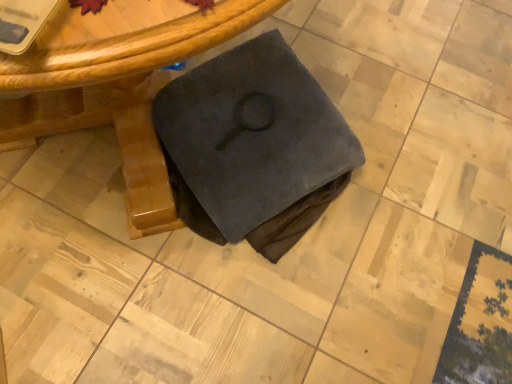
The height and width of the screenshot is (384, 512). Find the location of `wooden table at center`. wooden table at center is located at coordinates (117, 84).

What is the approximate width of wooden table at center?

The width of wooden table at center is 34.50 inches.

Image resolution: width=512 pixels, height=384 pixels. What do you see at coordinates (117, 84) in the screenshot?
I see `wooden table at center` at bounding box center [117, 84].

In order to face wooden table at center, should I rotate leftwards or rightwards?

Turn left approximately 19.901 degrees to face it.

Describe the element at coordinates (254, 146) in the screenshot. The width and height of the screenshot is (512, 384). I see `dark suede book at center` at that location.

At what (x,y) coordinates should I click in order to perform the action: click on dark suede book at center. Please return your answer as a coordinate pair (x, y). The width and height of the screenshot is (512, 384). Looking at the image, I should click on (254, 146).

This screenshot has height=384, width=512. Identify the location of wooden table at center. (117, 84).

Can you confirm if wooden table at center is positioned to the right of dark suede book at center?

In fact, wooden table at center is to the left of dark suede book at center.

Considering their positions, is wooden table at center located in front of or behind dark suede book at center?

Clearly, wooden table at center is in front of dark suede book at center.

Is point (106, 60) closer or farther from the camera than point (232, 233)?

Point (106, 60) appears to be closer to the viewer than point (232, 233).

From the image's perspective, which is above, wooden table at center or dark suede book at center?

wooden table at center is shown above in the image.

From a real-world perspective, does wooden table at center sit lower than dark suede book at center?

No, from a real-world perspective, wooden table at center is not beneath dark suede book at center.

Which object is thinner, wooden table at center or dark suede book at center?

With smaller width is dark suede book at center.

Does wooden table at center have a greater height compared to dark suede book at center?

Indeed, wooden table at center has a greater height compared to dark suede book at center.

Considering the sizes of objects wooden table at center and dark suede book at center in the image provided, who is bigger, wooden table at center or dark suede book at center?

wooden table at center.

Is wooden table at center not inside dark suede book at center?

Yes, wooden table at center is not within dark suede book at center.

Based on the photo, are wooden table at center and dark suede book at center beside each other?

No, wooden table at center is not with dark suede book at center.

Is wooden table at center looking in the opposite direction of dark suede book at center?

That's not correct — wooden table at center is not looking away from dark suede book at center.

How much distance is there between wooden table at center and dark suede book at center?

The distance of wooden table at center from dark suede book at center is 19.42 centimeters.

Find the location of a particular element. This screenshot has width=512, height=384. fabric below the wooden table at center (from a real-world perspective) is located at coordinates (254, 146).

Which is more to the right, dark suede book at center or wooden table at center?

From the viewer's perspective, dark suede book at center appears more on the right side.

In the scene shown: Considering their positions, is dark suede book at center located in front of or behind wooden table at center?

Clearly, dark suede book at center is behind wooden table at center.

Which is nearer, (289, 235) or (151, 194)?

Clearly, point (289, 235) is more distant from the camera than point (151, 194).

From the image's perspective, between dark suede book at center and wooden table at center, which one is located above?

wooden table at center appears higher in the image.

From a real-world perspective, between dark suede book at center and wooden table at center, who is vertically lower?

dark suede book at center is physically lower.

Between dark suede book at center and wooden table at center, which one has smaller width?

dark suede book at center.

Based on the photo, considering the relative sizes of dark suede book at center and wooden table at center in the image provided, is dark suede book at center taller than wooden table at center?

Incorrect, the height of dark suede book at center is not larger of that of wooden table at center.

Does dark suede book at center have a larger size compared to wooden table at center?

Actually, dark suede book at center might be smaller than wooden table at center.

Is dark suede book at center spatially inside wooden table at center, or outside of it?

dark suede book at center is contained in wooden table at center.

Is dark suede book at center placed right next to wooden table at center?

No, dark suede book at center is not touching wooden table at center.

Is dark suede book at center oriented away from wooden table at center?

Yes, dark suede book at center's orientation is away from wooden table at center.

Image resolution: width=512 pixels, height=384 pixels. I want to click on table in front of the dark suede book at center, so click(117, 84).

I want to click on fabric that appears on the right of wooden table at center, so click(x=254, y=146).

Where is `table on the left of dark suede book at center`? Image resolution: width=512 pixels, height=384 pixels. table on the left of dark suede book at center is located at coordinates (117, 84).